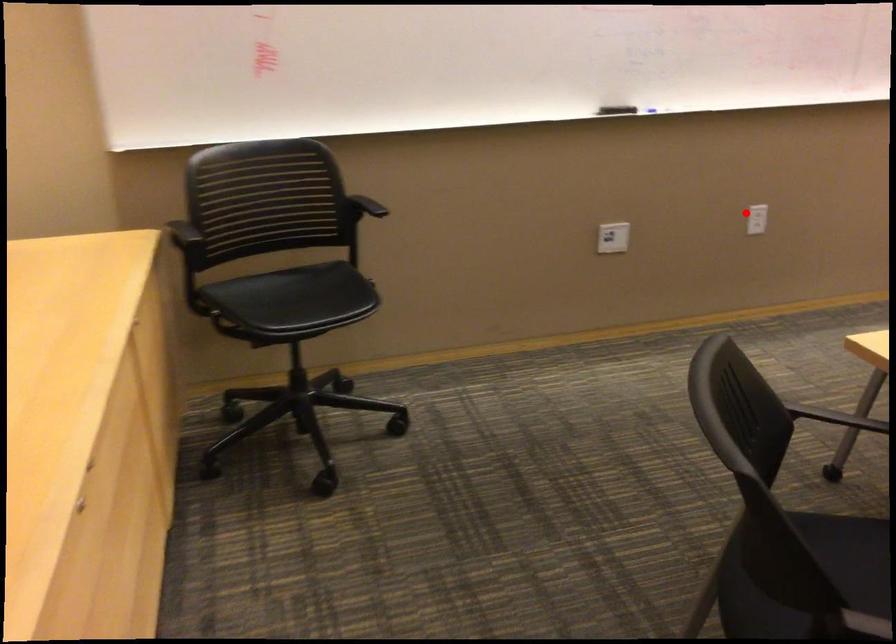
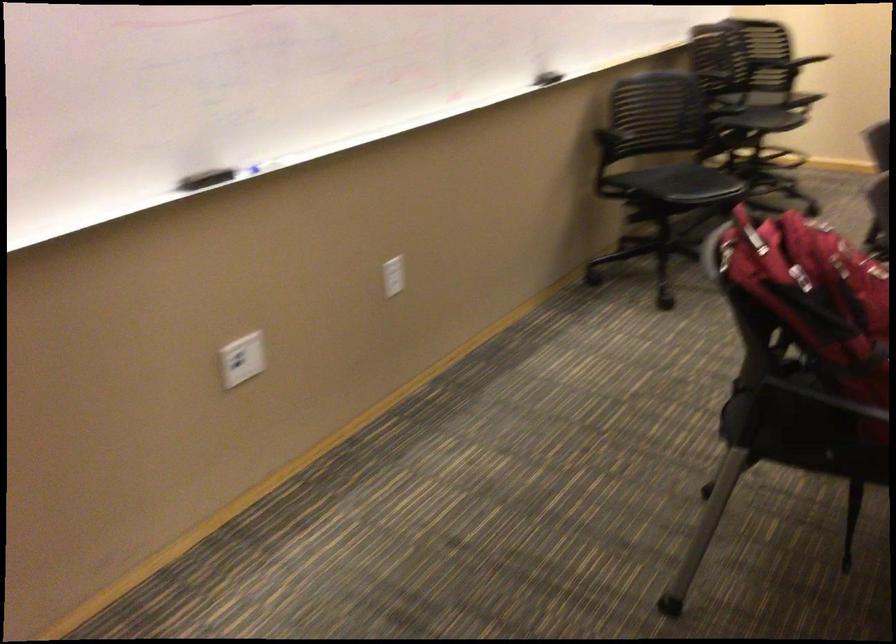
Question: A red point is marked in image1. In image2, is the corresponding 3D point closer to the camera or farther? Reply with the corresponding letter.

Choices:
 (A) The corresponding 3D point is closer.
 (B) The corresponding 3D point is farther.

Answer: (A)